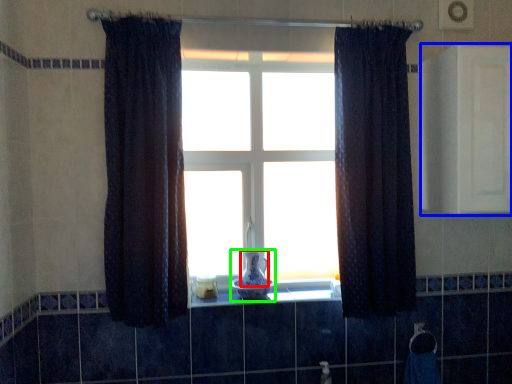
Question: Based on their relative distances, which object is nearer to glass vase (highlighted by a red box)? Choose from medicine cabinet (highlighted by a blue box) and glass vase (highlighted by a green box).

Choices:
 (A) medicine cabinet
 (B) glass vase

Answer: (B)